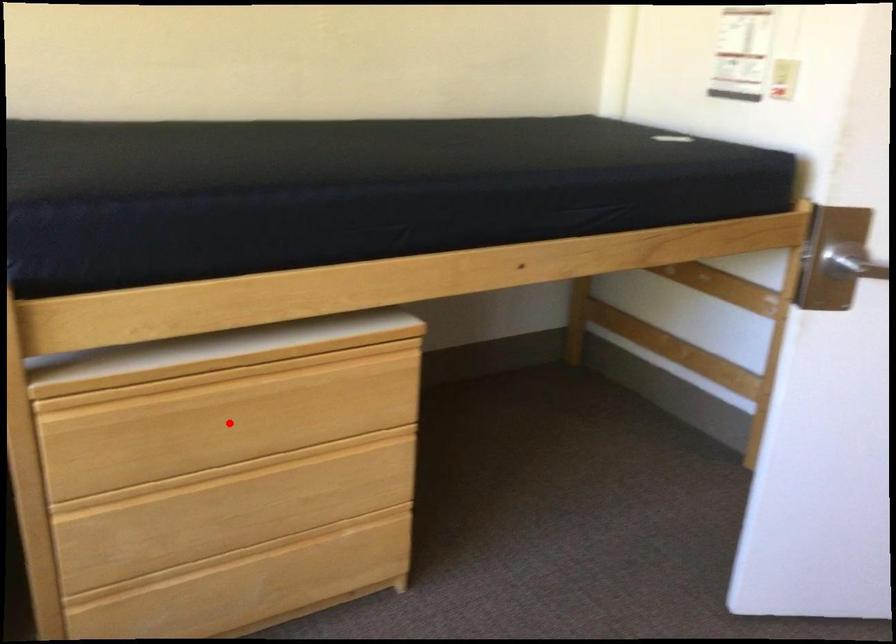
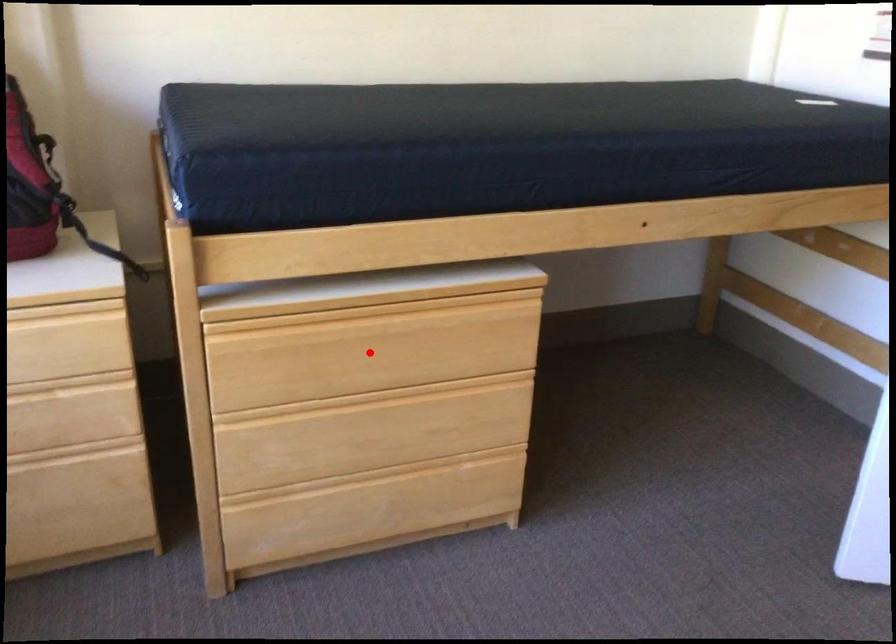
I am providing you with two images of the same scene from different viewpoints. A red point is marked on the first image and another point is marked on the second image. Is the red point in image1 aligned with the point shown in image2?

Yes